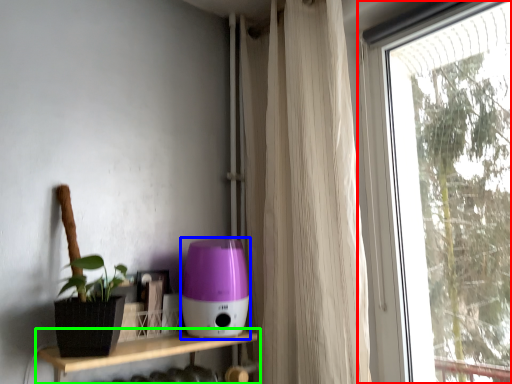
Question: Based on their relative distances, which object is nearer to window (highlighted by a red box)? Choose from appliance (highlighted by a blue box) and shelf (highlighted by a green box).

Choices:
 (A) appliance
 (B) shelf

Answer: (A)